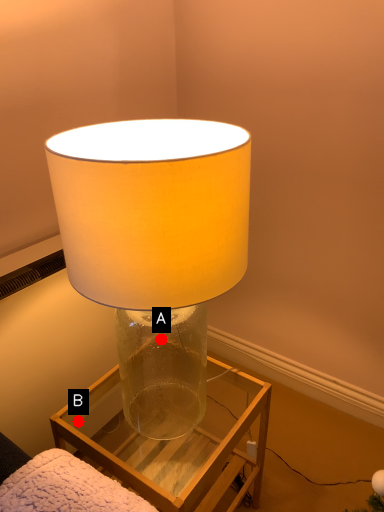
Question: Two points are circled on the image, labeled by A and B beside each circle. Which point is closer to the camera?

Choices:
 (A) A is closer
 (B) B is closer

Answer: (B)